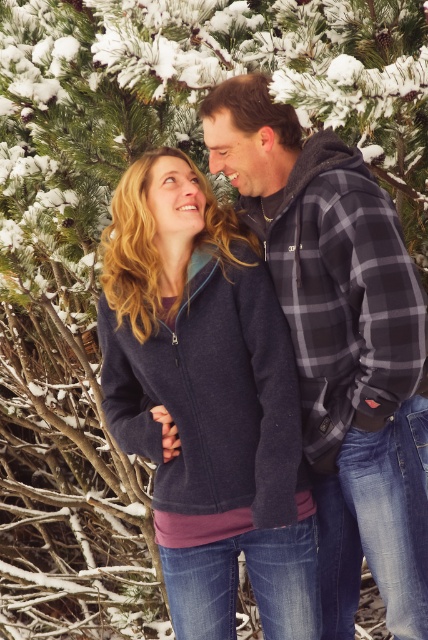
Question: Can you confirm if navy fleece jacket at center is thinner than plaid flannel shirt at center?

Choices:
 (A) yes
 (B) no

Answer: (B)

Question: Which point is closer to the camera taking this photo?

Choices:
 (A) (323, 353)
 (B) (255, 529)

Answer: (A)

Question: Among these points, which one is nearest to the camera?

Choices:
 (A) (238, 84)
 (B) (273, 634)

Answer: (A)

Question: Can you confirm if navy fleece jacket at center is wider than plaid flannel shirt at center?

Choices:
 (A) yes
 (B) no

Answer: (A)

Question: Can you confirm if navy fleece jacket at center is positioned to the right of plaid flannel shirt at center?

Choices:
 (A) yes
 (B) no

Answer: (B)